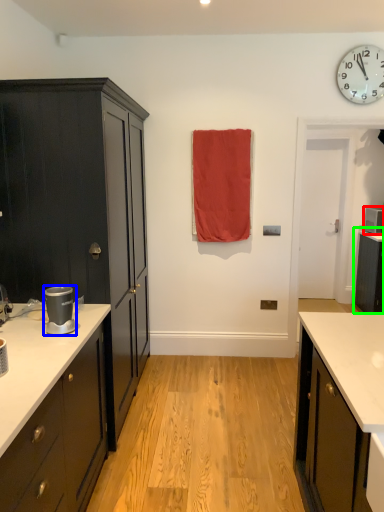
Question: Which object is the closest to the appliance (highlighted by a red box)? Choose among these: appliance (highlighted by a blue box) or cabinetry (highlighted by a green box).

Choices:
 (A) appliance
 (B) cabinetry

Answer: (B)